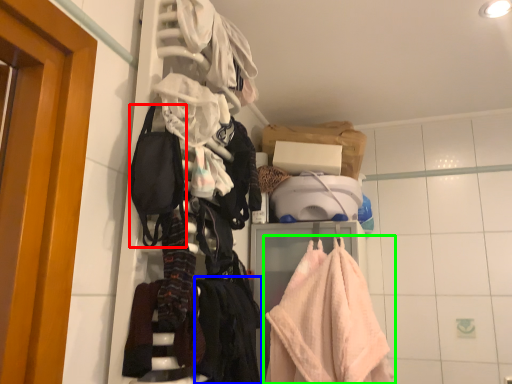
Question: Which is farther away from accessory (highlighted by a red box)? clothing (highlighted by a blue box) or towel (highlighted by a green box)?

Choices:
 (A) clothing
 (B) towel

Answer: (B)